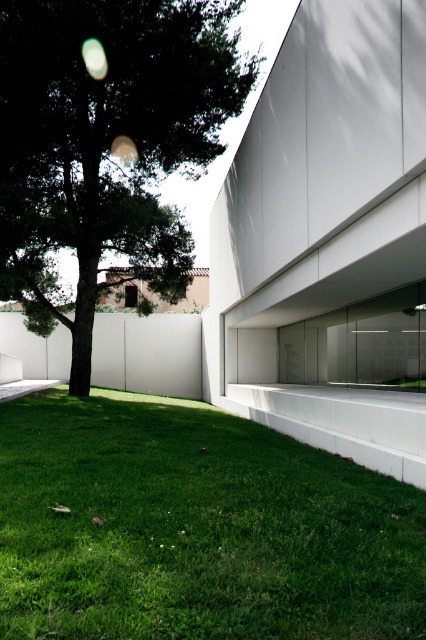
Looking at this image, is green grass at lower left to the right of green leafy tree at left from the viewer's perspective?

Correct, you'll find green grass at lower left to the right of green leafy tree at left.

How distant is green grass at lower left from green leafy tree at left?

A distance of 24.06 feet exists between green grass at lower left and green leafy tree at left.

At what (x,y) coordinates should I click in order to perform the action: click on green grass at lower left. Please return your answer as a coordinate pair (x, y). This screenshot has width=426, height=640. Looking at the image, I should click on (195, 529).